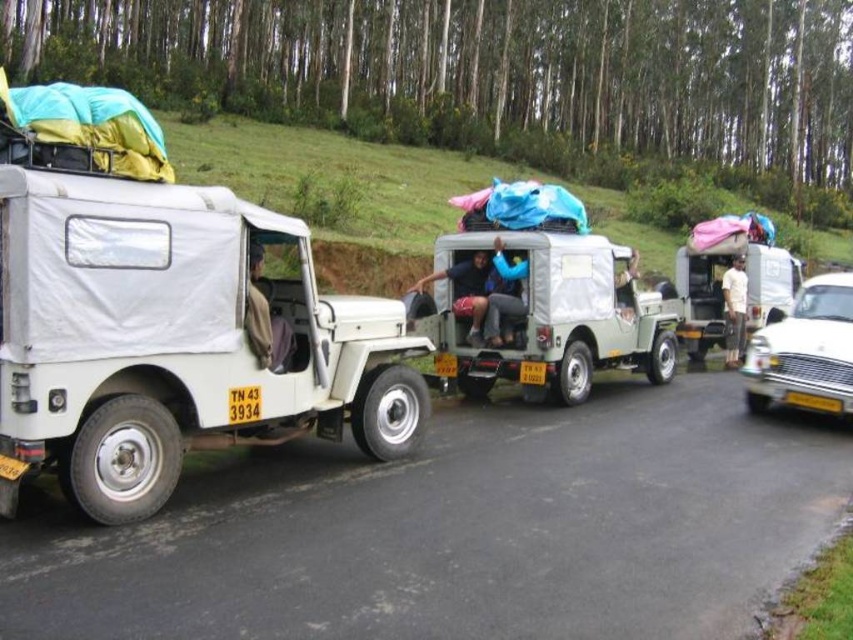
Between white matte trailer truck at left and white cotton shirt at center, which one has more height?

white matte trailer truck at left

What do you see at coordinates (172, 340) in the screenshot?
I see `white matte trailer truck at left` at bounding box center [172, 340].

At what (x,y) coordinates should I click in order to perform the action: click on white matte trailer truck at left. Please return your answer as a coordinate pair (x, y). Looking at the image, I should click on (172, 340).

You are a GUI agent. You are given a task and a screenshot of the screen. Output one action in this format:
    pyautogui.click(x=<x>, y=<y>)
    Task: Click on the brown fabric shirt at left
    
    Given the screenshot: What is the action you would take?
    pyautogui.click(x=265, y=320)

Does brown fabric shirt at left come behind white cotton shirt at center?

No, brown fabric shirt at left is in front of white cotton shirt at center.

Is point (254, 328) behind point (735, 275)?

No, it is not.

Where is `brown fabric shirt at left`? brown fabric shirt at left is located at coordinates (265, 320).

Is dark blue fabric bag at center positioned before yellow plastic license plate at center?

No, dark blue fabric bag at center is further to the viewer.

Between point (461, 291) and point (821, 404), which one is positioned behind?

The point (461, 291) is behind.

Is point (460, 266) positioned behind point (817, 401)?

Yes, point (460, 266) is behind point (817, 401).

Image resolution: width=853 pixels, height=640 pixels. In order to click on dark blue fabric bag at center in this screenshot , I will do `click(465, 291)`.